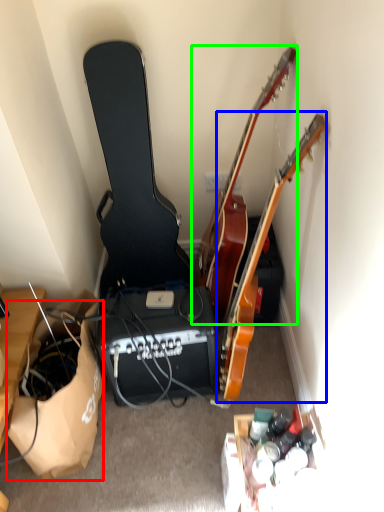
Question: Estimate the real-world distances between objects in this image. Which object is closer to paper bag (highlighted by a red box), guitar (highlighted by a blue box) or guitar (highlighted by a green box)?

Choices:
 (A) guitar
 (B) guitar

Answer: (A)